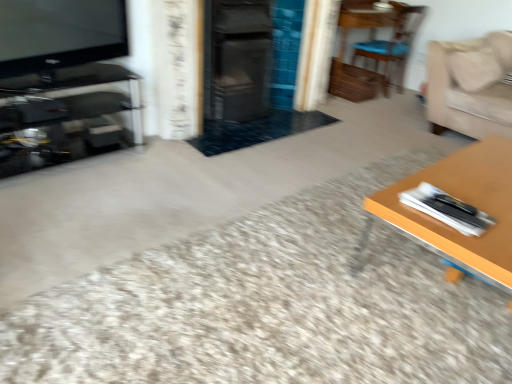
Question: From a real-world perspective, is matte black tv at upper left above or below beige fabric couch at upper right?

Choices:
 (A) below
 (B) above

Answer: (B)

Question: Is point (109, 34) positioned closer to the camera than point (437, 59)?

Choices:
 (A) farther
 (B) closer

Answer: (B)

Question: Estimate the real-world distances between objects in this image. Which object is closer to the beige fabric couch at upper right?

Choices:
 (A) matte black tv at upper left
 (B) wooden chair at upper right
 (C) wooden table at right
 (D) black glass entertainment center at left

Answer: (B)

Question: Which is nearer to the matte black tv at upper left?

Choices:
 (A) beige fabric couch at upper right
 (B) wooden chair at upper right
 (C) black glass entertainment center at left
 (D) wooden table at right

Answer: (C)